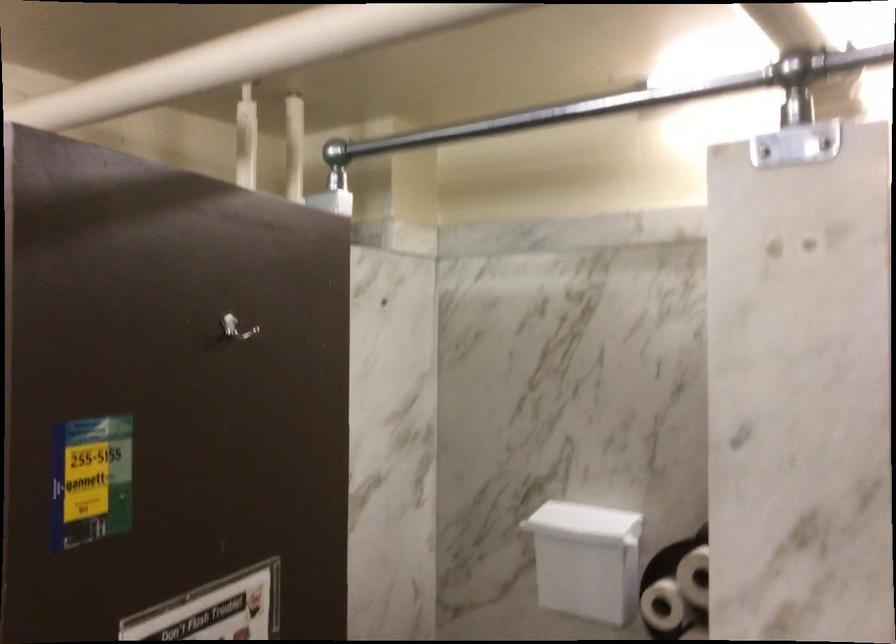
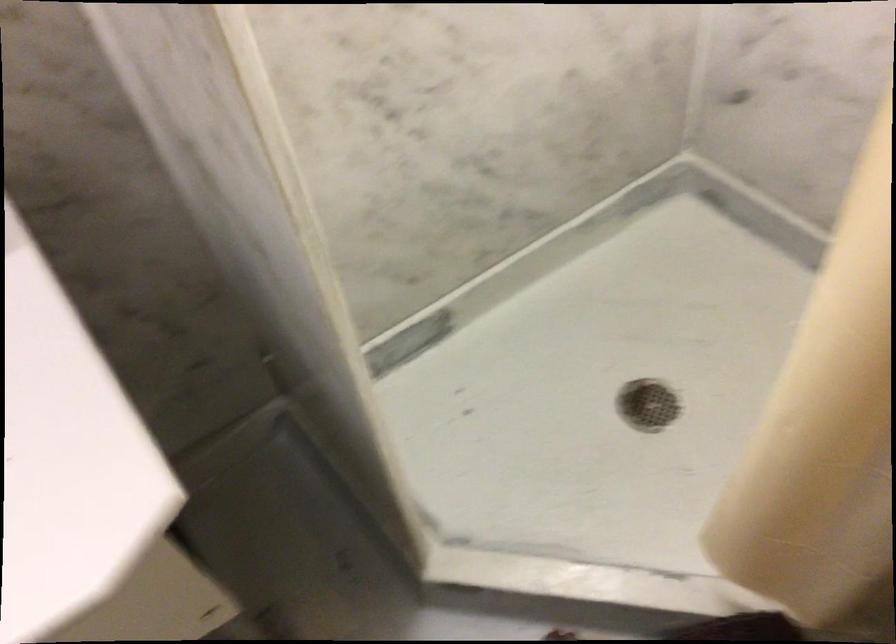
First-person continuous shooting, in which direction is the camera rotating?

The camera rotated toward left-down.